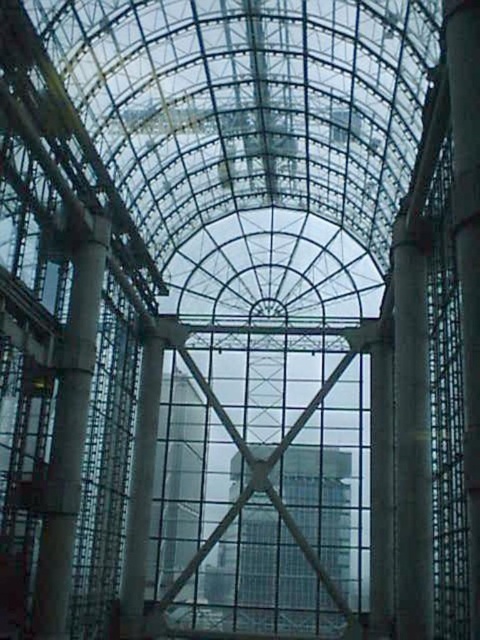
You are an architect designing a new glasshouse and want to ensure structural stability. You have two pillars available for support. The smooth concrete pillar at center and the concrete pillar at left. Which pillar should you choose to provide more support based on their sizes?

The smooth concrete pillar at center is larger in size than the concrete pillar at left, so it can provide more support and should be chosen for structural stability.

From the picture: You are a maintenance worker needing to inspect two pillars in a glasshouse. You have a ladder that is 30 meters long. The pillars are the smooth concrete pillar at center and the concrete pillar at left. Can your ladder reach from one pillar to the other?

The smooth concrete pillar at center is 29.44 meters away from the concrete pillar at left. Since the ladder is 30 meters long, which is longer than the distance between them, the ladder can reach from one pillar to the other.

You are standing inside the glasshouse and want to take a photo of the point at coordinates point [414,225]. If your camera has a maximum focus range of 200 feet, will it be able to focus on that point?

The distance of point [414,225] from camera is 226.71 feet, which exceeds the camera maximum focus range of 200 feet. Therefore, the camera cannot focus on that point.